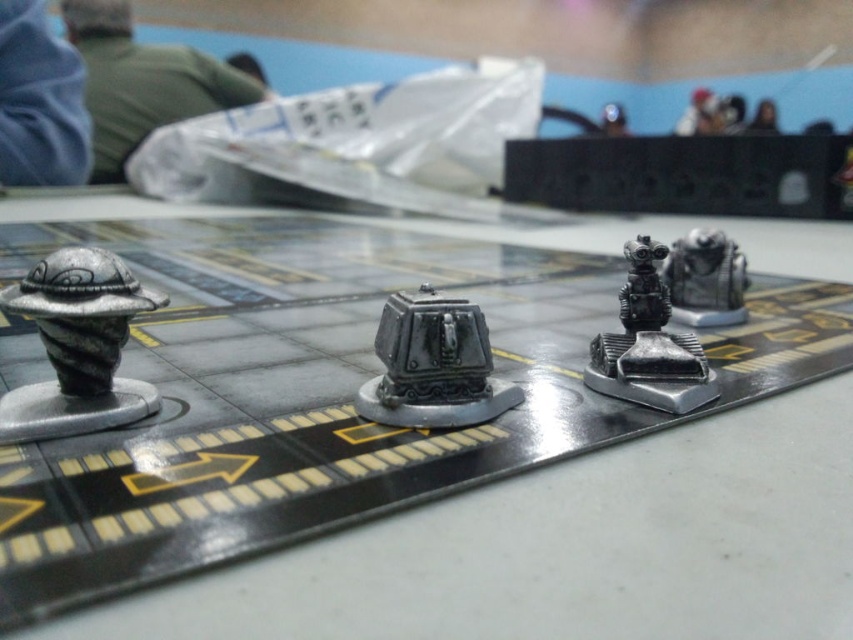
Measure the distance between metallic silver robot at center and metallic gray cube at center.

A distance of 4.11 feet exists between metallic silver robot at center and metallic gray cube at center.

Between metallic silver robot at center and metallic gray cube at center, which one is positioned lower?

metallic gray cube at center is lower down.

Who is more forward, (222,611) or (447,364)?

Positioned in front is point (222,611).

I want to click on metallic silver robot at center, so click(567, 548).

Can you confirm if metallic silver robot at center is shorter than metallic robot at center?

No.

Based on the photo, can you confirm if metallic silver robot at center is wider than metallic robot at center?

Indeed, metallic silver robot at center has a greater width compared to metallic robot at center.

This screenshot has width=853, height=640. What do you see at coordinates (567, 548) in the screenshot?
I see `metallic silver robot at center` at bounding box center [567, 548].

Locate an element on the screen. The width and height of the screenshot is (853, 640). metallic silver robot at center is located at coordinates (567, 548).

Looking at this image, how far apart are metallic gray cube at center and metallic robot at center?

metallic gray cube at center and metallic robot at center are 8.18 inches apart.

The image size is (853, 640). Identify the location of metallic gray cube at center. pos(433,365).